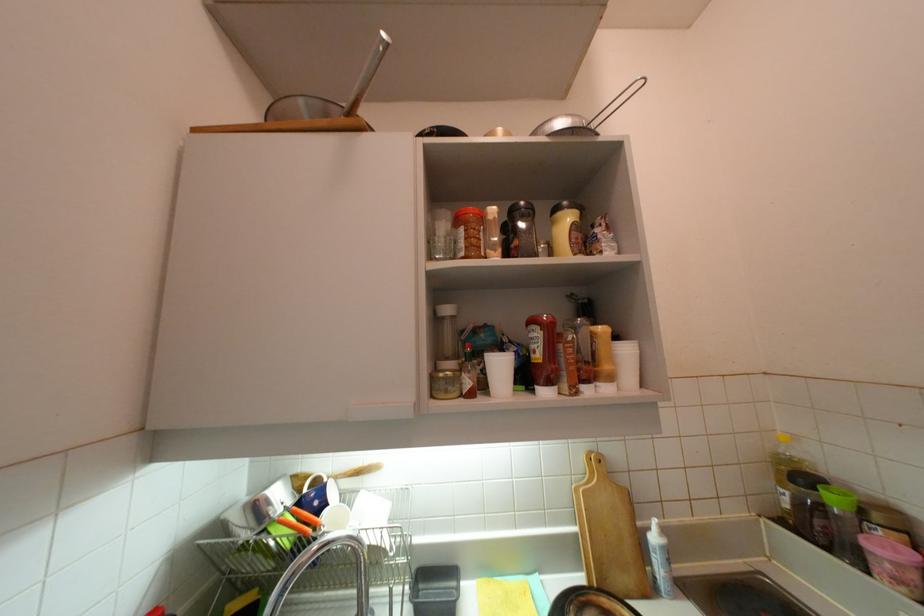
Where would you squeez the yellow squeeze bottle? Please return your answer as a coordinate pair (x, y).

(602, 359)